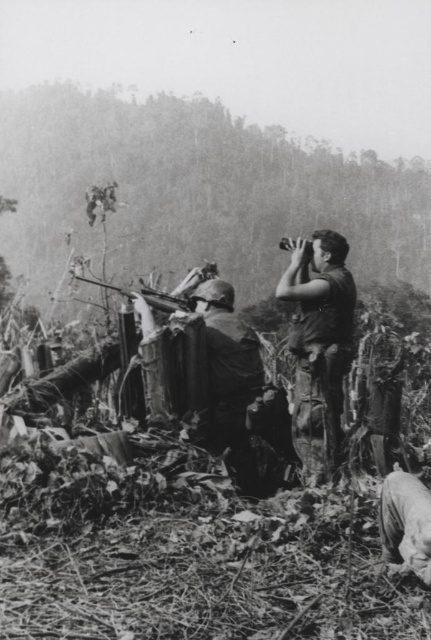
Question: Can you confirm if camouflage pants at right is positioned below metallic rifle at center?

Choices:
 (A) no
 (B) yes

Answer: (B)

Question: Does camouflage pants at right have a larger size compared to metallic rifle at center?

Choices:
 (A) no
 (B) yes

Answer: (A)

Question: Which object is closer to the camera taking this photo?

Choices:
 (A) camouflage pants at right
 (B) metallic rifle at center

Answer: (A)

Question: Does camouflage pants at right appear on the left side of metallic rifle at center?

Choices:
 (A) yes
 (B) no

Answer: (B)